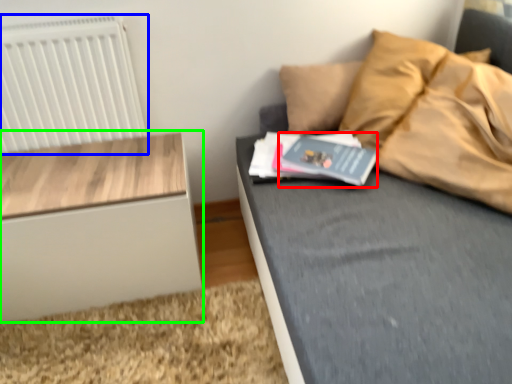
Question: Which object is the farthest from paperback book (highlighted by a red box)? Choose among these: radiator (highlighted by a blue box) or nightstand (highlighted by a green box).

Choices:
 (A) radiator
 (B) nightstand

Answer: (A)